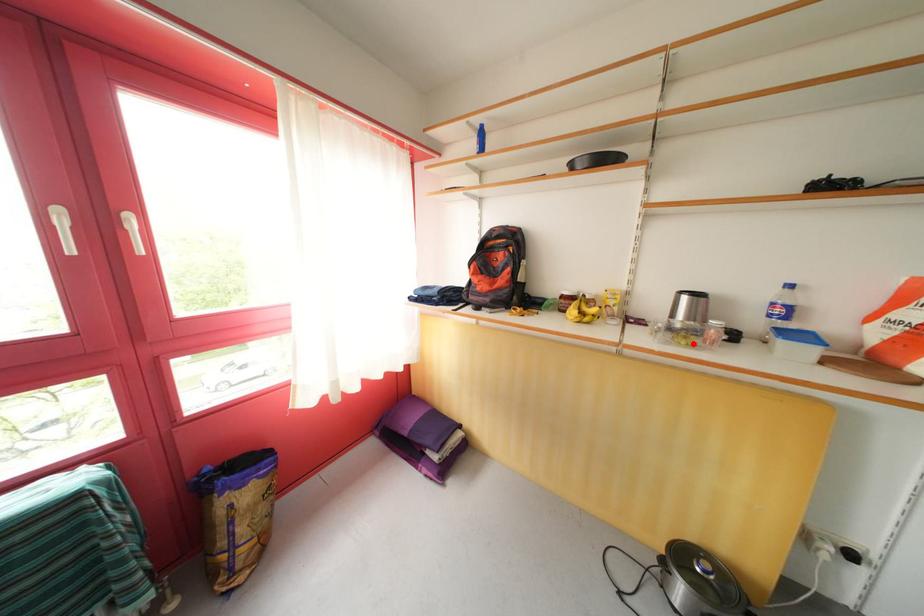
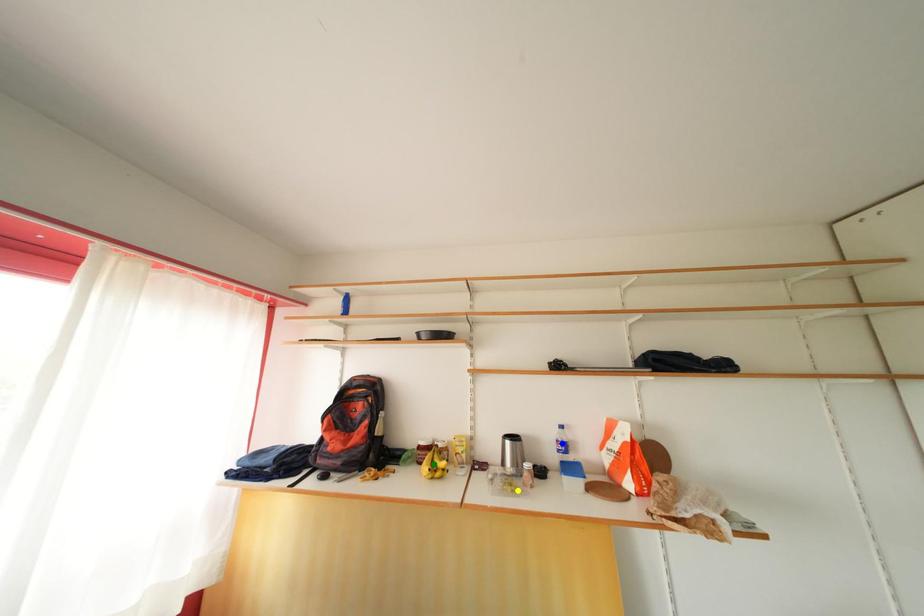
Question: I am providing you with two images of the same scene from different viewpoints. A red point is marked on the first image. You are given multiple points on the second image. Which point in image 2 is actually the same real-world point as the red point in image 1?

Choices:
 (A) yellow point
 (B) blue point
 (C) green point

Answer: (A)